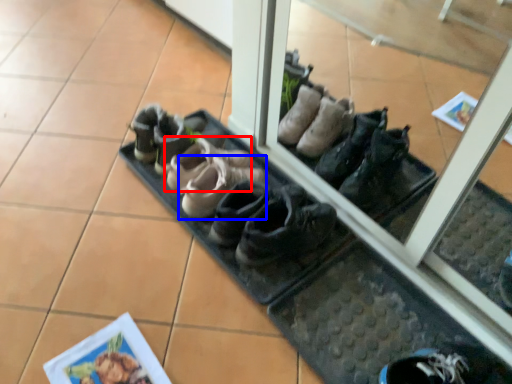
Question: Which object is further to the camera taking this photo, footwear (highlighted by a red box) or footwear (highlighted by a blue box)?

Choices:
 (A) footwear
 (B) footwear

Answer: (A)